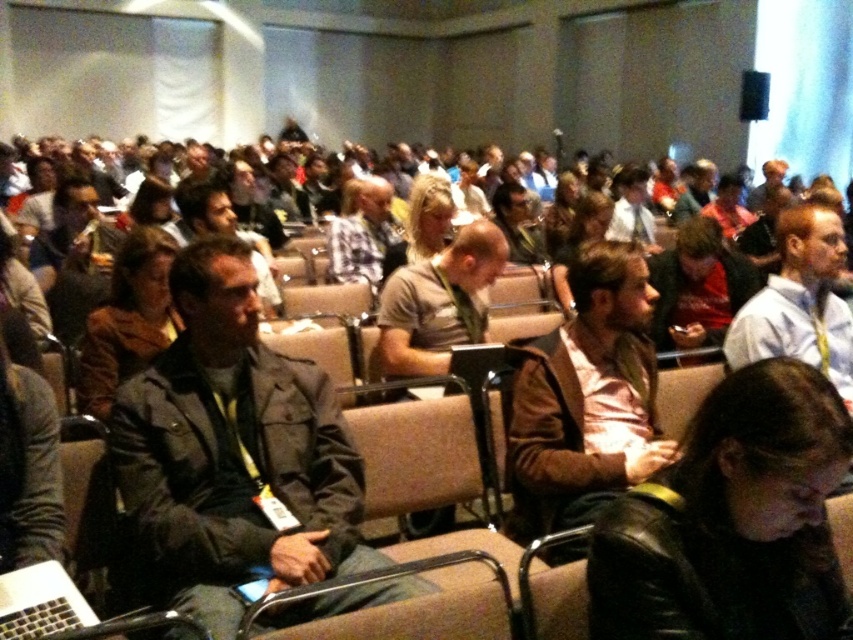
Does dark gray jacket at center come behind black leather jacket at lower right?

Yes, it is behind black leather jacket at lower right.

I want to click on dark gray jacket at center, so click(231, 452).

Between dark gray jacket at center and brown leather jacket at center, which one has more height?

Answer: dark gray jacket at center

Does dark gray jacket at center appear on the right side of brown leather jacket at center?

In fact, dark gray jacket at center is to the left of brown leather jacket at center.

Between point (244, 380) and point (558, 508), which one is positioned in front?

Positioned in front is point (244, 380).

Where is `dark gray jacket at center`? The height and width of the screenshot is (640, 853). dark gray jacket at center is located at coordinates (231, 452).

Does brown fuzzy coat at center have a lesser height compared to matte black jacket at center?

Yes.

Can you confirm if brown fuzzy coat at center is positioned below matte black jacket at center?

Yes.

This screenshot has height=640, width=853. I want to click on brown fuzzy coat at center, so [128, 320].